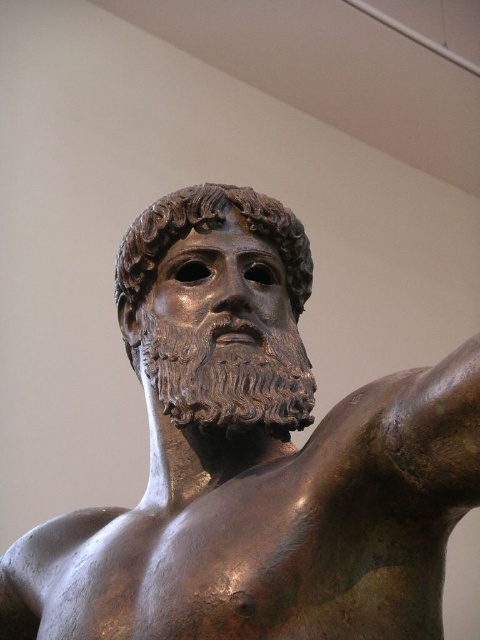
You are an art conservator examining the bronze statue at center and the bronze mask at center. Which object has a larger size according to the description?

The bronze mask at center is larger than the bronze statue at center.

You are an art conservator examining the bronze statue at center and the bronze mask at center. Which object is shorter in height?

The bronze statue at center is not as tall as the bronze mask at center, so the bronze statue at center is shorter in height.